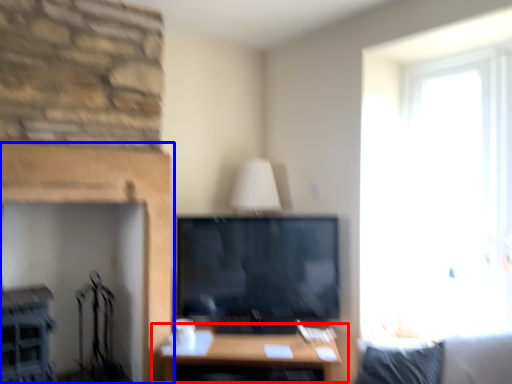
Question: Which of the following is the farthest to the observer, table (highlighted by a red box) or fireplace (highlighted by a blue box)?

Choices:
 (A) table
 (B) fireplace

Answer: (A)